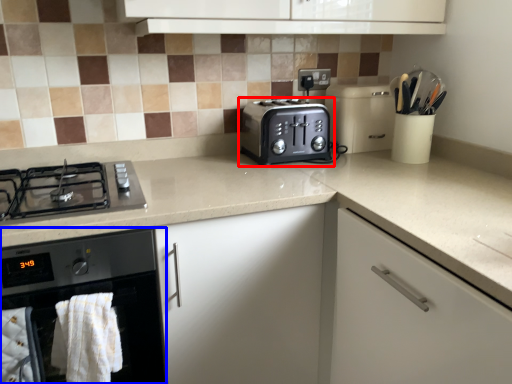
Question: Which object is further to the camera taking this photo, toaster (highlighted by a red box) or home appliance (highlighted by a blue box)?

Choices:
 (A) toaster
 (B) home appliance

Answer: (A)